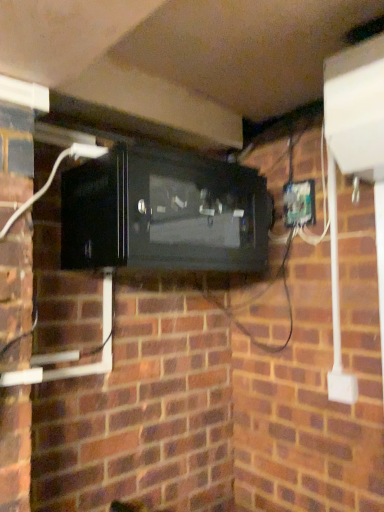
Where is `green plastic electric outlet at right`? This screenshot has width=384, height=512. green plastic electric outlet at right is located at coordinates coord(299,203).

This screenshot has width=384, height=512. What do you see at coordinates (299, 203) in the screenshot? I see `green plastic electric outlet at right` at bounding box center [299, 203].

The width and height of the screenshot is (384, 512). Describe the element at coordinates (164, 213) in the screenshot. I see `black glossy microwave at center` at that location.

Find the location of a particular element. black glossy microwave at center is located at coordinates (164, 213).

Find the location of `green plastic electric outlet at right`. green plastic electric outlet at right is located at coordinates (299, 203).

Is black glossy microwave at center at the left side of green plastic electric outlet at right?

Yes, black glossy microwave at center is to the left of green plastic electric outlet at right.

Which is behind, black glossy microwave at center or green plastic electric outlet at right?

green plastic electric outlet at right.

Considering the positions of point (104, 228) and point (312, 194), is point (104, 228) closer or farther from the camera than point (312, 194)?

Clearly, point (104, 228) is closer to the camera than point (312, 194).

From the image's perspective, relative to green plastic electric outlet at right, is black glossy microwave at center above or below?

black glossy microwave at center is below green plastic electric outlet at right.

From a real-world perspective, is black glossy microwave at center located beneath green plastic electric outlet at right?

Yes.

Is black glossy microwave at center thinner than green plastic electric outlet at right?

No, black glossy microwave at center is not thinner than green plastic electric outlet at right.

Considering the relative sizes of black glossy microwave at center and green plastic electric outlet at right in the image provided, is black glossy microwave at center taller than green plastic electric outlet at right?

Indeed, black glossy microwave at center has a greater height compared to green plastic electric outlet at right.

Who is bigger, black glossy microwave at center or green plastic electric outlet at right?

With larger size is black glossy microwave at center.

Do you think black glossy microwave at center is within green plastic electric outlet at right, or outside of it?

black glossy microwave at center is spatially situated outside green plastic electric outlet at right.

Are black glossy microwave at center and green plastic electric outlet at right beside each other?

No, black glossy microwave at center is not making contact with green plastic electric outlet at right.

Is black glossy microwave at center facing towards green plastic electric outlet at right?

No.

How distant is black glossy microwave at center from green plastic electric outlet at right?

black glossy microwave at center is 20.82 inches away from green plastic electric outlet at right.

Identify the location of electric outlet on the right of black glossy microwave at center. (299, 203).

Does green plastic electric outlet at right appear on the right side of black glossy microwave at center?

Yes.

Relative to black glossy microwave at center, is green plastic electric outlet at right in front or behind?

In the image, green plastic electric outlet at right appears behind black glossy microwave at center.

Considering the positions of points (289, 192) and (149, 164), is point (289, 192) farther from camera compared to point (149, 164)?

Yes, it is behind point (149, 164).

From the image's perspective, is green plastic electric outlet at right located above or below black glossy microwave at center?

green plastic electric outlet at right is situated higher than black glossy microwave at center in the image.

From a real-world perspective, which is physically below, green plastic electric outlet at right or black glossy microwave at center?

In real-world perspective, black glossy microwave at center is lower.

Between green plastic electric outlet at right and black glossy microwave at center, which one has smaller width?

green plastic electric outlet at right is thinner.

Between green plastic electric outlet at right and black glossy microwave at center, which one has less height?

green plastic electric outlet at right is shorter.

Based on their sizes in the image, would you say green plastic electric outlet at right is bigger or smaller than black glossy microwave at center?

In the image, green plastic electric outlet at right appears to be smaller than black glossy microwave at center.

Do you think green plastic electric outlet at right is within black glossy microwave at center, or outside of it?

green plastic electric outlet at right exists outside the volume of black glossy microwave at center.

Is green plastic electric outlet at right touching black glossy microwave at center?

No.

Is green plastic electric outlet at right turned away from black glossy microwave at center?

No.

Image resolution: width=384 pixels, height=512 pixels. I want to click on appliance on the left of green plastic electric outlet at right, so click(164, 213).

Locate an element on the screen. electric outlet behind the black glossy microwave at center is located at coordinates (299, 203).

There is a black glossy microwave at center. Where is `electric outlet above it (from a real-world perspective)`? Image resolution: width=384 pixels, height=512 pixels. electric outlet above it (from a real-world perspective) is located at coordinates (299, 203).